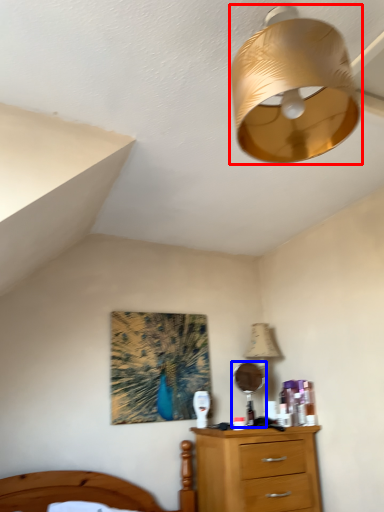
Question: Which point is closer to the camera, lamp (highlighted by a red box) or mirror (highlighted by a blue box)?

Choices:
 (A) lamp
 (B) mirror

Answer: (A)